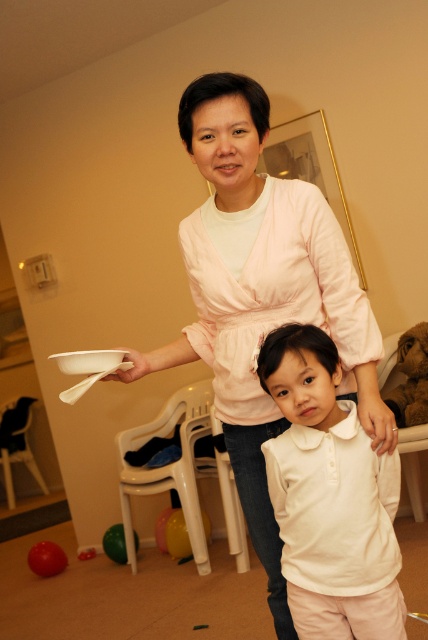
Question: Can you confirm if matte pink blouse at center is smaller than white matte shirt at center?

Choices:
 (A) yes
 (B) no

Answer: (B)

Question: Which object appears closest to the camera in this image?

Choices:
 (A) green rubber ball at lower left
 (B) white matte plate at upper left

Answer: (B)

Question: Which is farther from the rubber ball at lower left?

Choices:
 (A) white matte plate at upper left
 (B) green rubber ball at lower left

Answer: (A)

Question: Is white matte plate at upper left behind rubber ball at lower left?

Choices:
 (A) yes
 (B) no

Answer: (B)

Question: Does matte pink blouse at center have a greater width compared to white matte plate at upper left?

Choices:
 (A) yes
 (B) no

Answer: (A)

Question: Which point appears closest to the camera in this image?

Choices:
 (A) (354, 586)
 (B) (101, 353)

Answer: (A)